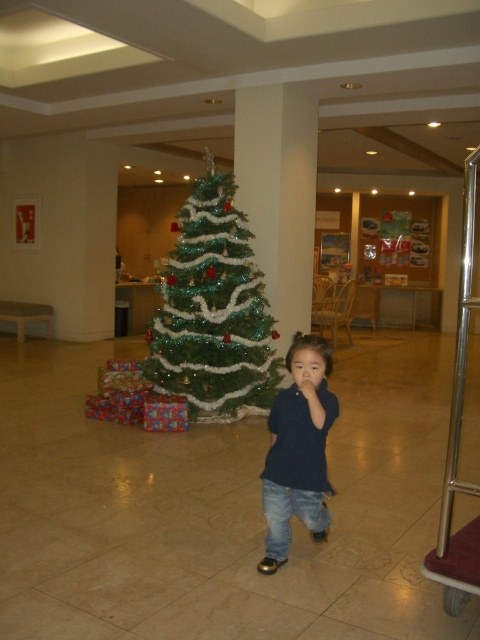
Is green shiny christmas tree at center smaller than dark blue shirt at center?

Incorrect, green shiny christmas tree at center is not smaller in size than dark blue shirt at center.

Consider the image. Is green shiny christmas tree at center to the right of dark blue shirt at center from the viewer's perspective?

In fact, green shiny christmas tree at center is to the left of dark blue shirt at center.

Find the location of `green shiny christmas tree at center`. green shiny christmas tree at center is located at coordinates (214, 310).